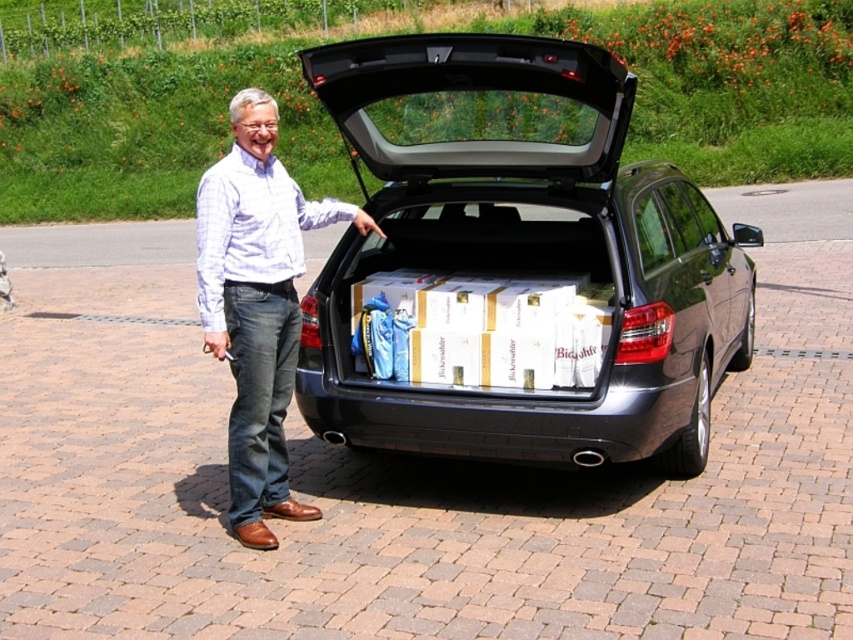
You are a photographer taking a picture of the scene. You need to ensure both the satin black car at center and the light blue plaid shirt at center are clearly visible. Based on their positions, which one should you focus on first to ensure depth of field captures both?

The satin black car at center is located below the light blue plaid shirt at center. To ensure both are in focus, you should focus on the light blue plaid shirt at center first since it is closer to the camera, allowing the depth of field to extend backward to the car below it.

You are a photographer trying to capture a photo of the satin black car at center and the light blue plaid shirt at center. You need to ensure that both subjects are fully visible in the frame. Given that the camera has a fixed focal length, which subject should you prioritize positioning closer to the camera to ensure both are in focus?

Since the satin black car at center is wider than the light blue plaid shirt at center, you should position the satin black car at center closer to the camera. This will help ensure both subjects are within the depth of field and in focus.